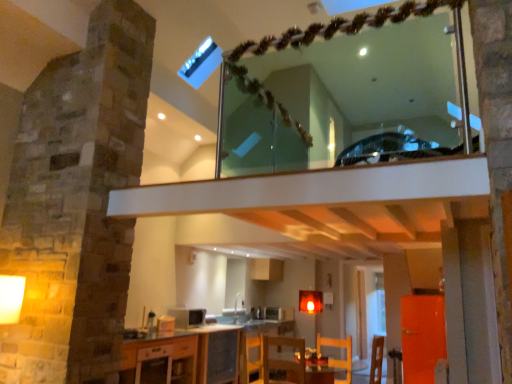
Question: Do you think wooden chair at lower center, which is counted as the 2th armchair, starting from the left, is within metallic silver microwave at center, which is the second appliance from top to bottom, or outside of it?

Choices:
 (A) inside
 (B) outside

Answer: (B)

Question: From a real-world perspective, is wooden chair at lower center, which is counted as the 2th armchair, starting from the left, above or below metallic silver microwave at center, which appears as the 2th appliance when viewed from the front?

Choices:
 (A) above
 (B) below

Answer: (B)

Question: Estimate the real-world distances between objects in this image. Which object is closer to the clear glass mirror at upper center?

Choices:
 (A) metallic silver microwave at center, which ranks as the 1th appliance in right-to-left order
 (B) matte white microwave at center, placed as the second appliance when sorted from back to front
 (C) white glossy cabinet at lower center
 (D) white glossy sink at center
 (E) wooden chair at lower center, which is counted as the 2th armchair, starting from the left

Answer: (C)

Question: Which of these objects is positioned closest to the wooden chair at lower center, which appears as the 1th armchair when viewed from the left?

Choices:
 (A) matte white microwave at center, which appears as the 1th appliance when viewed from the front
 (B) white glossy cabinet at lower center
 (C) white glossy sink at center
 (D) metallic silver microwave at center, which ranks as the 1th appliance in right-to-left order
 (E) wooden chair at lower center, which is counted as the 2th armchair, starting from the left

Answer: (E)